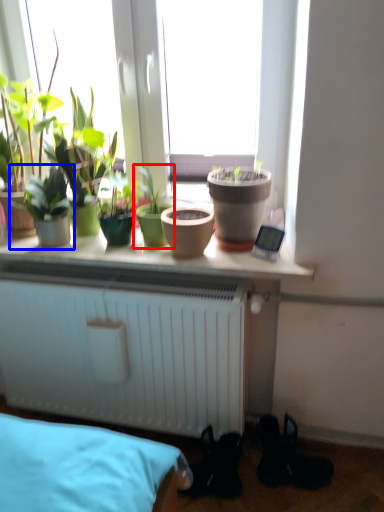
Question: Which point is closer to the camera, houseplant (highlighted by a red box) or houseplant (highlighted by a blue box)?

Choices:
 (A) houseplant
 (B) houseplant

Answer: (B)